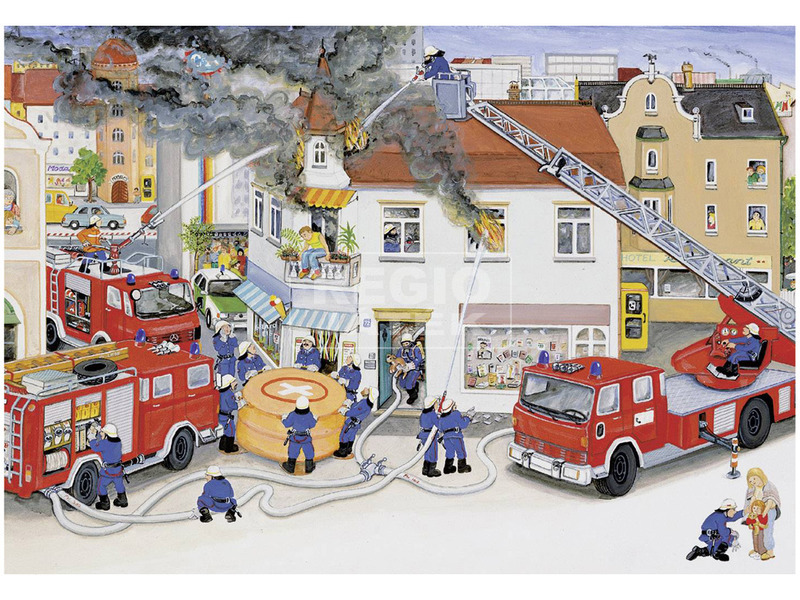
Locate an element on the screen. The image size is (800, 600). plant is located at coordinates (349, 240).